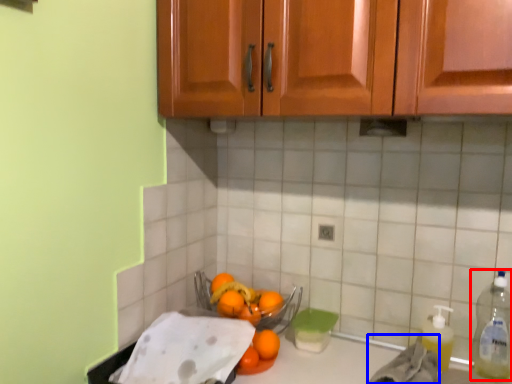
Question: Among these objects, which one is farthest to the camera, bottle (highlighted by a red box) or material (highlighted by a blue box)?

Choices:
 (A) bottle
 (B) material

Answer: (A)